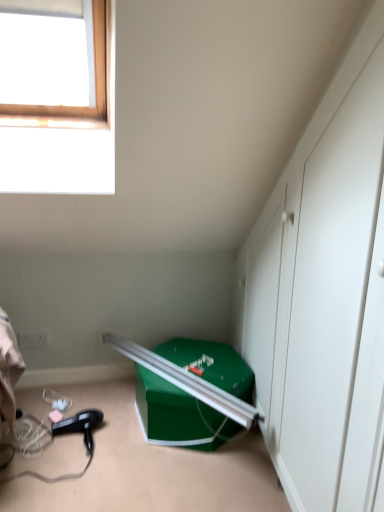
This screenshot has height=512, width=384. I want to click on free space in front of black plastic hair dryer at lower left, so click(x=76, y=472).